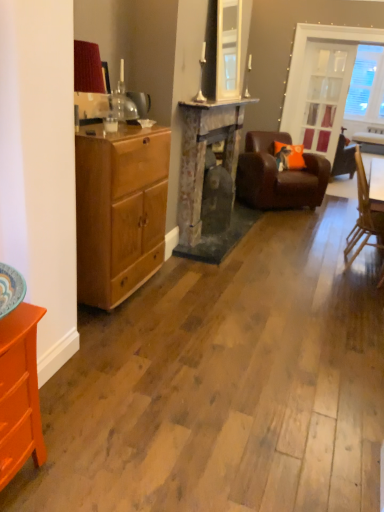
Question: From the image's perspective, is orange painted wood dresser at lower left above wooden chair at right, arranged as the 2th chair when viewed from the back?

Choices:
 (A) yes
 (B) no

Answer: (B)

Question: Is orange painted wood dresser at lower left wider than wooden chair at right, the first chair from the front?

Choices:
 (A) yes
 (B) no

Answer: (A)

Question: Is wooden chair at right, the first chair from the front, at the back of orange painted wood dresser at lower left?

Choices:
 (A) yes
 (B) no

Answer: (B)

Question: Considering the relative positions of orange painted wood dresser at lower left and wooden chair at right, arranged as the 2th chair when viewed from the back, in the image provided, is orange painted wood dresser at lower left to the left of wooden chair at right, arranged as the 2th chair when viewed from the back, from the viewer's perspective?

Choices:
 (A) no
 (B) yes

Answer: (B)

Question: From the image's perspective, is orange painted wood dresser at lower left below wooden chair at right, arranged as the 2th chair when viewed from the back?

Choices:
 (A) yes
 (B) no

Answer: (A)

Question: In terms of width, does light brown wood cabinet at left look wider or thinner when compared to clear glass door at upper right?

Choices:
 (A) wide
 (B) thin

Answer: (A)

Question: From a real-world perspective, is light brown wood cabinet at left physically located above or below clear glass door at upper right?

Choices:
 (A) below
 (B) above

Answer: (A)

Question: Is light brown wood cabinet at left spatially inside clear glass door at upper right, or outside of it?

Choices:
 (A) outside
 (B) inside

Answer: (A)

Question: In the image, is light brown wood cabinet at left positioned in front of or behind clear glass door at upper right?

Choices:
 (A) behind
 (B) front

Answer: (B)

Question: Is point (357, 230) closer or farther from the camera than point (302, 190)?

Choices:
 (A) closer
 (B) farther

Answer: (A)

Question: Visually, is wooden chair at right, arranged as the 2th chair when viewed from the back, positioned to the left or to the right of brown leather armchair at center, the 2th chair viewed from the front?

Choices:
 (A) left
 (B) right

Answer: (B)

Question: From a real-world perspective, is wooden chair at right, arranged as the 2th chair when viewed from the back, physically located above or below brown leather armchair at center, the 2th chair viewed from the front?

Choices:
 (A) above
 (B) below

Answer: (A)

Question: From the image's perspective, is wooden chair at right, the first chair from the front, positioned above or below brown leather armchair at center, arranged as the first chair when viewed from the back?

Choices:
 (A) below
 (B) above

Answer: (A)

Question: Is point (185, 157) positioned closer to the camera than point (153, 246)?

Choices:
 (A) closer
 (B) farther

Answer: (B)

Question: Considering the positions of rustic stone fireplace at center and light brown wood cabinet at left in the image, is rustic stone fireplace at center bigger or smaller than light brown wood cabinet at left?

Choices:
 (A) small
 (B) big

Answer: (B)